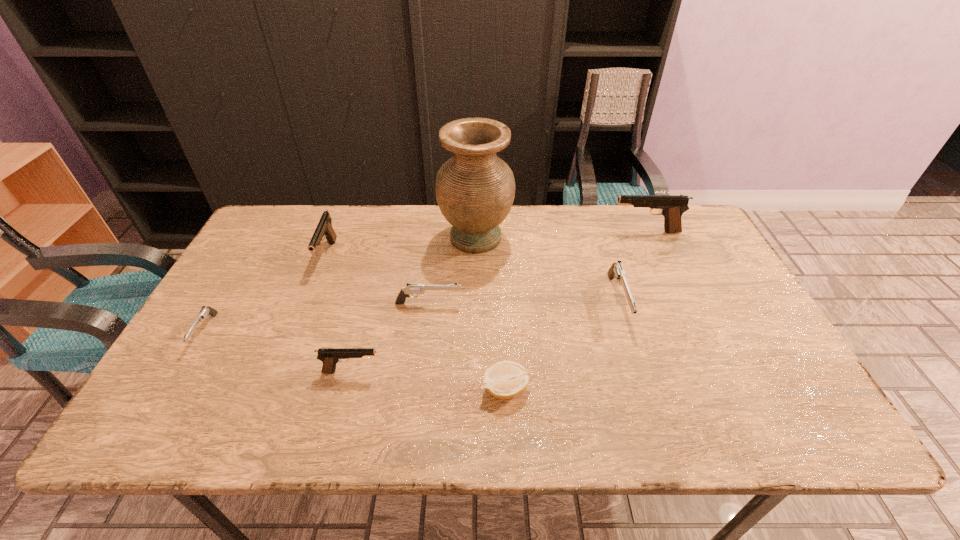
Locate an element on the screen. This screenshot has height=540, width=960. green vase is located at coordinates (475, 189).

I want to click on the tallest object, so click(475, 189).

The image size is (960, 540). Identify the location of the rightmost object. click(672, 207).

Identify the location of the farthest pistol. (672, 207).

The image size is (960, 540). Find the location of `the second object from left to right`. the second object from left to right is located at coordinates (324, 228).

The height and width of the screenshot is (540, 960). Find the location of `the sixth shortest object`. the sixth shortest object is located at coordinates (324, 228).

Where is `the biggest silver pistol`? The height and width of the screenshot is (540, 960). the biggest silver pistol is located at coordinates (616, 271).

At what (x,y) coordinates should I click in order to perform the action: click on the rightmost silver pistol. Please return your answer as a coordinate pair (x, y). Image resolution: width=960 pixels, height=540 pixels. Looking at the image, I should click on (616, 271).

Find the location of a particular element. The width and height of the screenshot is (960, 540). the fourth pistol from right to left is located at coordinates (330, 357).

The width and height of the screenshot is (960, 540). I want to click on the sixth object from right to left, so click(330, 357).